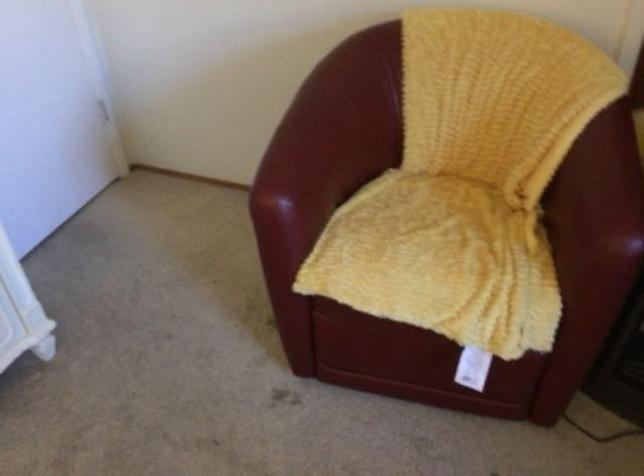
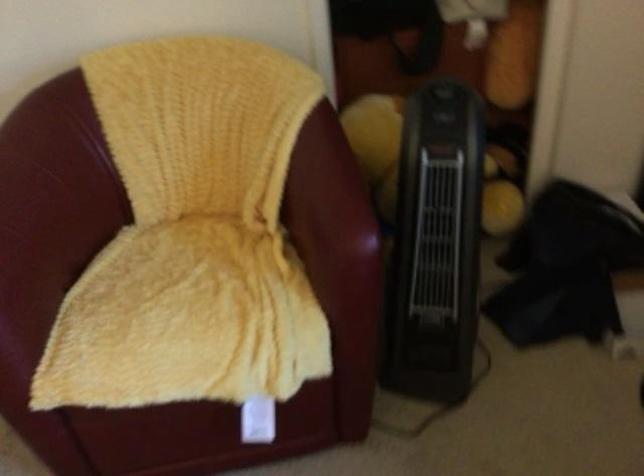
Question: How did the camera likely rotate?

Choices:
 (A) Left
 (B) Right
 (C) Up
 (D) Down

Answer: (B)